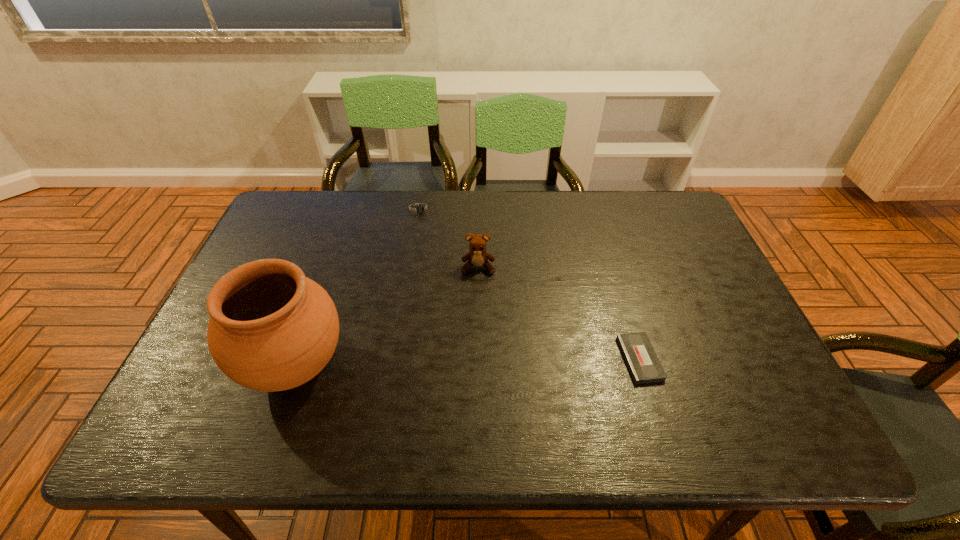
Where is `pottery`? This screenshot has width=960, height=540. pottery is located at coordinates (271, 329).

The image size is (960, 540). I want to click on the tallest object, so click(x=271, y=329).

Find the location of `videotape`. videotape is located at coordinates (641, 359).

Find the location of a particular element. the shortest object is located at coordinates (641, 359).

Image resolution: width=960 pixels, height=540 pixels. I want to click on the third shortest object, so click(477, 257).

Locate an element on the screen. the third object from left to right is located at coordinates (477, 257).

In order to click on the third tallest object in this screenshot , I will do `click(421, 208)`.

I want to click on the second object from left to right, so click(421, 208).

Where is `vacant space positioned on the back of the tallest object`? The width and height of the screenshot is (960, 540). vacant space positioned on the back of the tallest object is located at coordinates pos(325,279).

This screenshot has height=540, width=960. Identify the location of vacant region located 0.120m on the right of the shortest object. (708, 359).